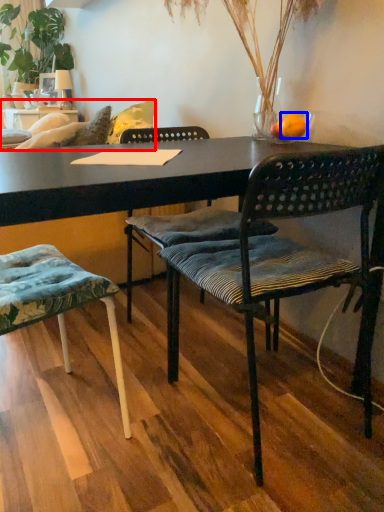
Question: Which of the following is the farthest to the observer, studio couch (highlighted by a red box) or orange (highlighted by a blue box)?

Choices:
 (A) studio couch
 (B) orange

Answer: (A)